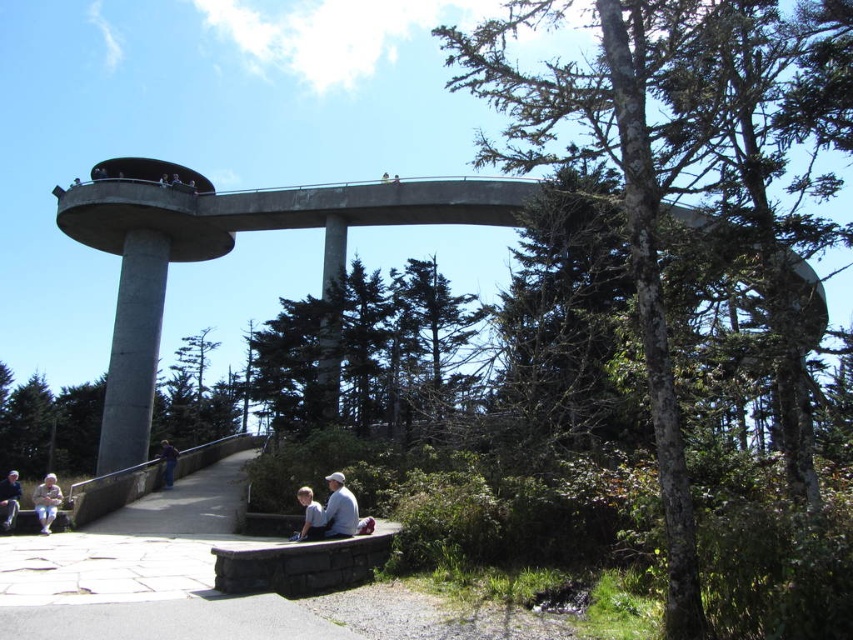
You are standing on the viewing deck and want to borrow a jacket from someone. You see the light blue denim jacket at lower center and the light beige fabric jacket at lower left. Which jacket is positioned more to the left side of the deck?

The light beige fabric jacket at lower left is positioned more to the left side of the deck.

You are standing on the viewing deck and notice two jackets hanging on a railing at the lower left corner. Which jacket is positioned more to the left between the light beige fabric jacket at lower left and the light brown leather jacket at lower left?

The light brown leather jacket at lower left is positioned more to the left since the light beige fabric jacket at lower left is to its right.

You are standing on the viewing deck and notice two jackets hanging on a railing nearby. The jackets are both at the lower left of your view. Which jacket is closer to the ground, the light beige fabric jacket at lower left or the light brown leather jacket at lower left?

The light brown leather jacket at lower left is closer to the ground because the light beige fabric jacket at lower left is positioned above it.